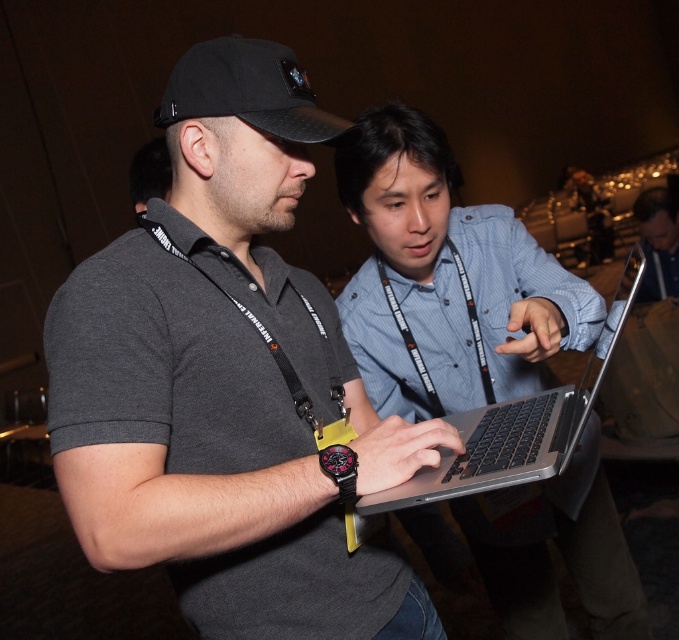
Question: Which point is farther to the camera?

Choices:
 (A) (340, 449)
 (B) (385, 294)

Answer: (B)

Question: Does blue denim shirt at center appear on the right side of black fabric lanyard at center?

Choices:
 (A) yes
 (B) no

Answer: (A)

Question: Can you confirm if silver metallic laptop at center is positioned to the left of black fabric lanyard at center?

Choices:
 (A) no
 (B) yes

Answer: (A)

Question: Is blue denim shirt at center thinner than black fabric baseball cap at upper center?

Choices:
 (A) no
 (B) yes

Answer: (A)

Question: Among these objects, which one is farthest from the camera?

Choices:
 (A) dark gray polo shirt at center
 (B) silver metallic laptop at center
 (C) black fabric baseball cap at upper center

Answer: (C)

Question: Which object is the farthest from the blue denim shirt at center?

Choices:
 (A) black fabric baseball cap at upper center
 (B) black fabric lanyard at center
 (C) dark gray polo shirt at center

Answer: (A)